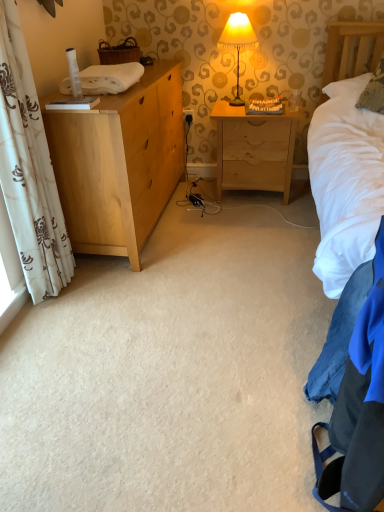
Question: Should I look upward or downward to see white floral fabric curtain at left?

Choices:
 (A) up
 (B) down

Answer: (A)

Question: From a real-world perspective, is light wood nightstand at center positioned over white floral fabric curtain at left based on gravity?

Choices:
 (A) no
 (B) yes

Answer: (A)

Question: Is there a large distance between light wood nightstand at center and white floral fabric curtain at left?

Choices:
 (A) yes
 (B) no

Answer: (A)

Question: Does light wood nightstand at center have a lesser height compared to white floral fabric curtain at left?

Choices:
 (A) yes
 (B) no

Answer: (A)

Question: Is light wood nightstand at center to the left of white floral fabric curtain at left from the viewer's perspective?

Choices:
 (A) no
 (B) yes

Answer: (A)

Question: Is light wood nightstand at center looking in the opposite direction of white floral fabric curtain at left?

Choices:
 (A) yes
 (B) no

Answer: (B)

Question: Is light wood nightstand at center positioned before white floral fabric curtain at left?

Choices:
 (A) no
 (B) yes

Answer: (A)

Question: Is light wood nightstand at center completely or partially inside yellow fabric lampshade at upper center?

Choices:
 (A) yes
 (B) no

Answer: (B)

Question: Does yellow fabric lampshade at upper center have a smaller size compared to light wood nightstand at center?

Choices:
 (A) yes
 (B) no

Answer: (A)

Question: Can you confirm if yellow fabric lampshade at upper center is bigger than light wood nightstand at center?

Choices:
 (A) no
 (B) yes

Answer: (A)

Question: Is the depth of yellow fabric lampshade at upper center less than that of light wood nightstand at center?

Choices:
 (A) no
 (B) yes

Answer: (B)

Question: From the image's perspective, is yellow fabric lampshade at upper center over light wood nightstand at center?

Choices:
 (A) no
 (B) yes

Answer: (B)

Question: Is yellow fabric lampshade at upper center next to light wood nightstand at center?

Choices:
 (A) no
 (B) yes

Answer: (A)

Question: From the image's perspective, is light wood chest of drawers at left under textured beige pillow at upper right?

Choices:
 (A) yes
 (B) no

Answer: (A)